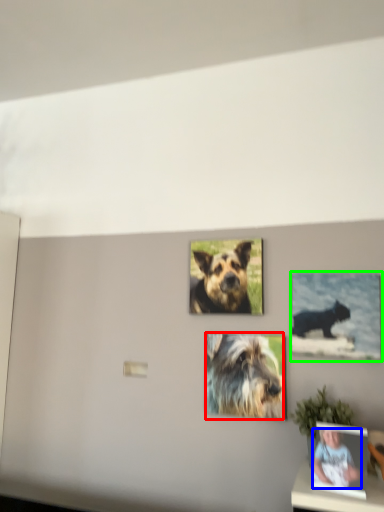
Question: Which object is the closest to the dog (highlighted by a red box)? Choose among these: person (highlighted by a blue box) or picture frame (highlighted by a green box).

Choices:
 (A) person
 (B) picture frame

Answer: (B)